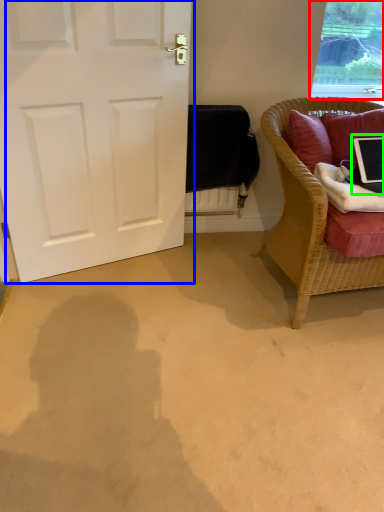
Question: Which object is the closest to the window (highlighted by a red box)? Choose among these: door (highlighted by a blue box) or laptop (highlighted by a green box).

Choices:
 (A) door
 (B) laptop

Answer: (B)